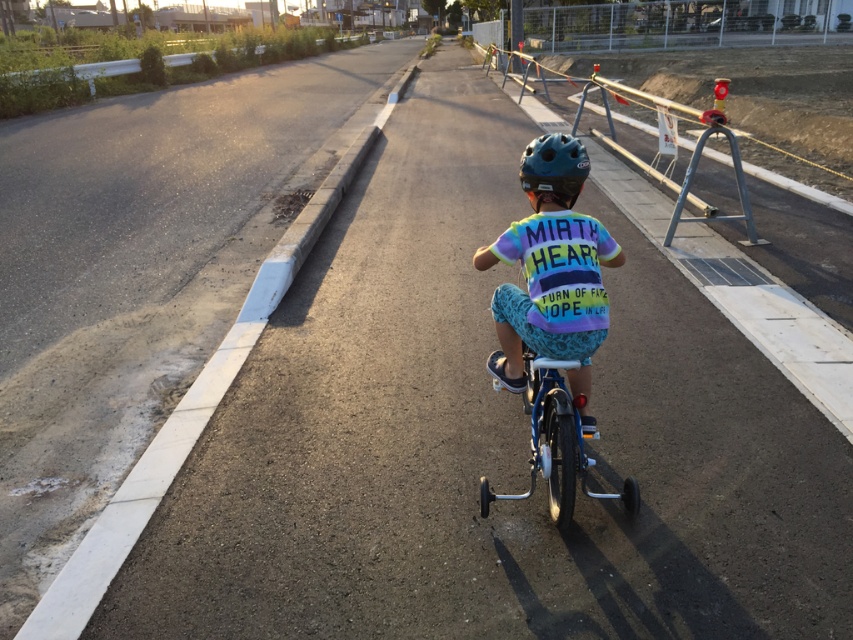
Question: Is blue metallic bicycle at center to the right of matte blue helmet at center from the viewer's perspective?

Choices:
 (A) yes
 (B) no

Answer: (A)

Question: Estimate the real-world distances between objects in this image. Which object is closer to the multicolored jersey at center?

Choices:
 (A) metallic silver rail at upper right
 (B) matte blue helmet at center

Answer: (B)

Question: Is multicolored jersey at center behind matte blue helmet at center?

Choices:
 (A) no
 (B) yes

Answer: (A)

Question: Does multicolored jersey at center have a larger size compared to matte blue helmet at center?

Choices:
 (A) yes
 (B) no

Answer: (A)

Question: Which point appears farthest from the camera in this image?

Choices:
 (A) (570, 301)
 (B) (740, 157)

Answer: (B)

Question: Which object is positioned farthest from the matte blue helmet at center?

Choices:
 (A) metallic silver rail at upper right
 (B) multicolored jersey at center
 (C) blue metallic bicycle at center

Answer: (A)